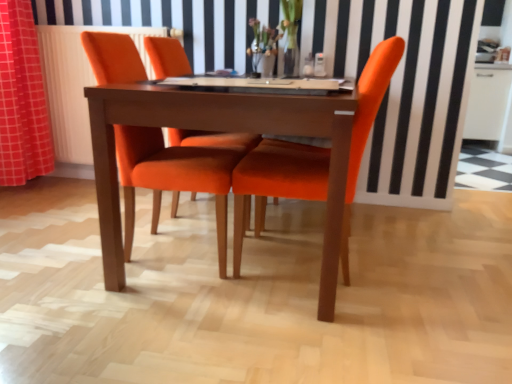
Find the location of a particular element. The width and height of the screenshot is (512, 384). free space in front of orange fabric chair at center, which appears as the second chair when viewed from the left is located at coordinates (323, 336).